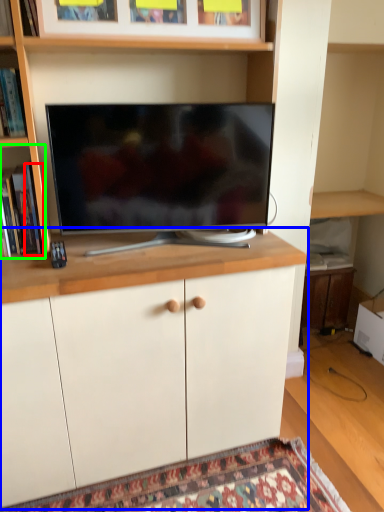
Question: Which is nearer to the book (highlighted by a red box)? cabinetry (highlighted by a blue box) or shelf (highlighted by a green box).

Choices:
 (A) cabinetry
 (B) shelf

Answer: (B)